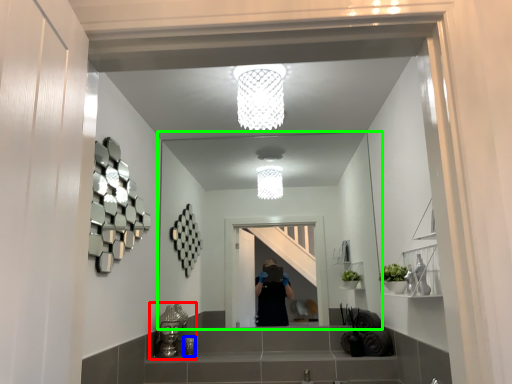
Question: Which object is the closest to the sink (highlighted by a red box)? Choose among these: toiletry (highlighted by a blue box) or mirror (highlighted by a green box).

Choices:
 (A) toiletry
 (B) mirror

Answer: (A)